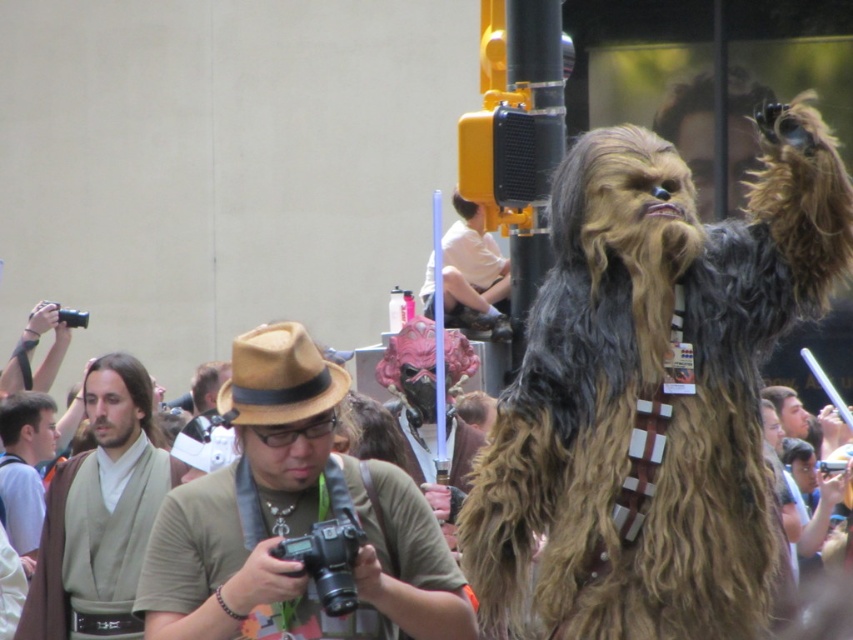
You are standing at the point labeled point (204, 490) and want to move towards the point labeled point (62, 522). Given that both points are in the same plane, which direction should you move to reach your destination?

You should move downward because point (62, 522) is located below point (204, 490).

You are standing at the point labeled point (427, 545) and want to take a photo of the Chewbacca costume. The Jedi with the camera is at point (488, 316). Can you see the Chewbacca costume from your current position without any obstruction?

Yes, because point (427, 545) is closer to the camera than point (488, 316), so the Jedi at point (488, 316) would be behind you and not blocking your view of the Chewbacca costume.